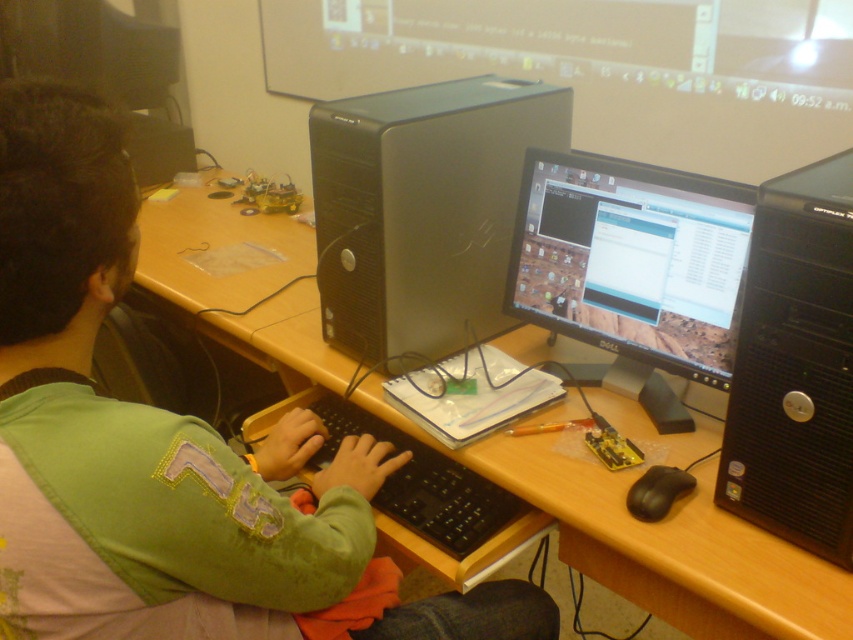
You are organizing a desk and have two items to place on it. The wooden at center and the satin black tower at center. Which item requires more desk space due to its size?

The wooden at center requires more desk space because it is larger in size than the satin black tower at center.

From the picture: You are a student in the classroom and need to reach both the point at coordinates point (x=816, y=282) and the point at coordinates point (x=450, y=465). Which point should you approach first if you want to reach them in the order they appear from your current position?

You should approach point (x=816, y=282) first because it is in front of point (x=450, y=465) from your current position.

You are organizing the desk items and need to place a new item between the wooden at center and the satin black tower at center. Based on their positions, which object should be on the left side of the new item?

The wooden at center is to the left of the satin black tower at center, so the new item should be placed between them with the wooden at center on its left side and the satin black tower at center on its right side.